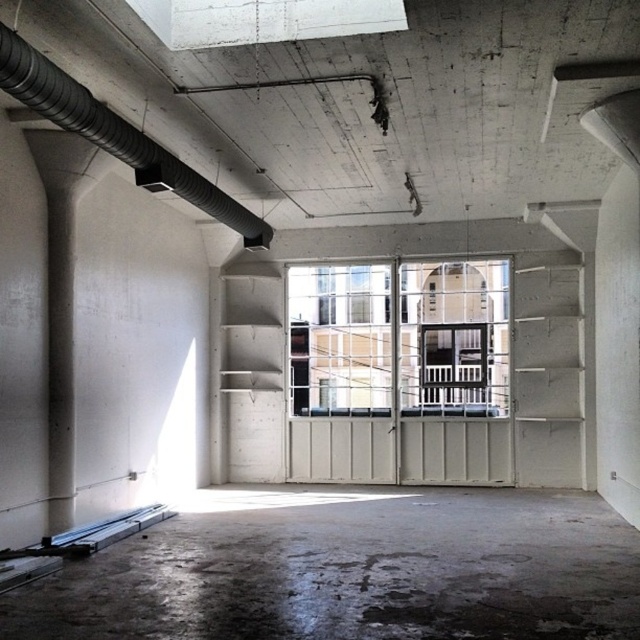
You are standing in the industrial room and want to look out through the clear glass window at center. Which direction should you move to reach it from the concrete floor at center?

The concrete floor at center is below the clear glass window at center, so you should move upward to reach the clear glass window at center.

You are an architect inspecting the unfinished industrial room. You notice the concrete floor at center and the clear glass window at center. Which one covers a larger area in the room?

The clear glass window at center covers a larger area than the concrete floor at center because the concrete floor at center has a smaller size compared to clear glass window at center.